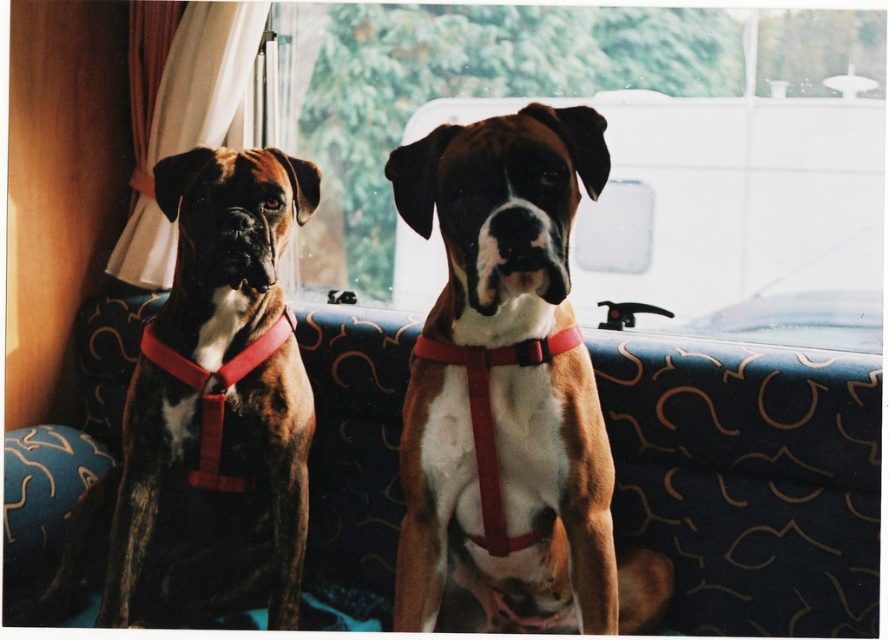
You are sitting on the blue fabric couch at center in a vehicle. You want to reach the brown brindle dog at left. Is the dog above or below you?

The blue fabric couch at center is below the brown brindle dog at left, so the dog is above you.

Based on the photo, you are a photographer standing 2 meters away from the camera position. You want to take a photo of the two Boxer dogs sitting on the patterned seat cover. However, there is an obstacle at point (437, 106) that might block your view. Can you confirm if the obstacle is closer to you than your current position?

The distance of point (437, 106) from the camera is 2.27 meters. Since you are standing 2 meters away from the camera position, the obstacle at point (437, 106) is 0.27 meters farther away from you than your current position, so it is not closer and will not block your view.

You are a passenger in the vehicle and want to look outside through the transparent glass window at center. Which direction should you turn your head to face the window?

The transparent glass window at center is located at point (609,145), so you should turn your head towards the center of the vehicle to face the window.